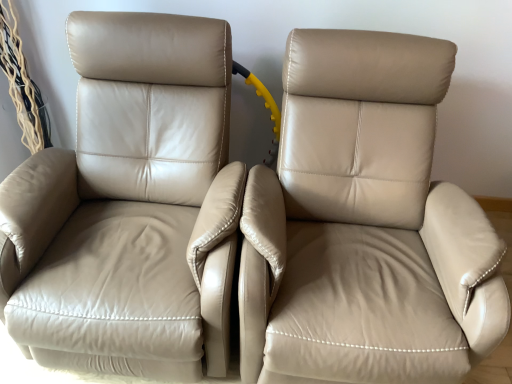
Question: Which direction should I rotate to look at beige leather chair at center, which is the second chair in left-to-right order?

Choices:
 (A) left
 (B) right

Answer: (B)

Question: From a real-world perspective, is beige leather chair at left, the second chair viewed from the right, positioned over beige leather chair at center, which is the second chair in left-to-right order, based on gravity?

Choices:
 (A) no
 (B) yes

Answer: (B)

Question: Does beige leather chair at left, the second chair viewed from the right, have a larger size compared to beige leather chair at center, which is the second chair in left-to-right order?

Choices:
 (A) yes
 (B) no

Answer: (B)

Question: Is beige leather chair at left, the second chair viewed from the right, at the left side of beige leather chair at center, acting as the first chair starting from the right?

Choices:
 (A) yes
 (B) no

Answer: (A)

Question: Considering the relative sizes of beige leather chair at left, the second chair viewed from the right, and beige leather chair at center, which is the second chair in left-to-right order, in the image provided, is beige leather chair at left, the second chair viewed from the right, thinner than beige leather chair at center, which is the second chair in left-to-right order,?

Choices:
 (A) yes
 (B) no

Answer: (A)

Question: Is the depth of beige leather chair at left, the second chair viewed from the right, less than that of beige leather chair at center, acting as the first chair starting from the right?

Choices:
 (A) no
 (B) yes

Answer: (A)

Question: Can you confirm if beige leather chair at left, positioned as the 1th chair in left-to-right order, is taller than beige leather chair at center, acting as the first chair starting from the right?

Choices:
 (A) yes
 (B) no

Answer: (B)

Question: Can you confirm if beige leather chair at center, which is the second chair in left-to-right order, is bigger than beige leather chair at left, positioned as the 1th chair in left-to-right order?

Choices:
 (A) no
 (B) yes

Answer: (B)

Question: From the image's perspective, is beige leather chair at center, acting as the first chair starting from the right, above beige leather chair at left, the second chair viewed from the right?

Choices:
 (A) no
 (B) yes

Answer: (A)

Question: Can you confirm if beige leather chair at center, acting as the first chair starting from the right, is shorter than beige leather chair at left, positioned as the 1th chair in left-to-right order?

Choices:
 (A) no
 (B) yes

Answer: (A)

Question: Is beige leather chair at left, the second chair viewed from the right, at the back of beige leather chair at center, which is the second chair in left-to-right order?

Choices:
 (A) yes
 (B) no

Answer: (B)

Question: Is beige leather chair at left, the second chair viewed from the right, inside beige leather chair at center, acting as the first chair starting from the right?

Choices:
 (A) yes
 (B) no

Answer: (B)

Question: Can you confirm if beige leather chair at center, acting as the first chair starting from the right, is taller than beige leather chair at left, positioned as the 1th chair in left-to-right order?

Choices:
 (A) yes
 (B) no

Answer: (A)

Question: Is point (266, 221) closer or farther from the camera than point (47, 243)?

Choices:
 (A) closer
 (B) farther

Answer: (A)